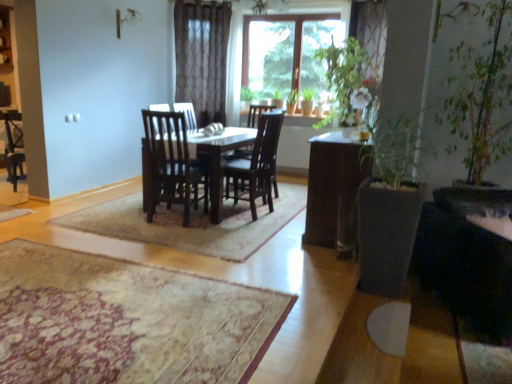
Question: Is beige textured rug at center thinner than metallic silver lamp at upper center?

Choices:
 (A) no
 (B) yes

Answer: (A)

Question: Is the position of beige textured rug at center less distant than that of metallic silver lamp at upper center?

Choices:
 (A) no
 (B) yes

Answer: (B)

Question: Would you say beige textured rug at center is outside metallic silver lamp at upper center?

Choices:
 (A) no
 (B) yes

Answer: (B)

Question: Considering the relative positions of beige textured rug at center and metallic silver lamp at upper center in the image provided, is beige textured rug at center to the right of metallic silver lamp at upper center from the viewer's perspective?

Choices:
 (A) yes
 (B) no

Answer: (A)

Question: Can you confirm if beige textured rug at center is wider than metallic silver lamp at upper center?

Choices:
 (A) no
 (B) yes

Answer: (B)

Question: From a real-world perspective, is beige textured rug at center physically above metallic silver lamp at upper center?

Choices:
 (A) yes
 (B) no

Answer: (B)

Question: Is metallic silver lamp at upper center completely or partially outside of beige textured rug at center?

Choices:
 (A) no
 (B) yes

Answer: (B)

Question: Is metallic silver lamp at upper center thinner than beige textured rug at center?

Choices:
 (A) no
 (B) yes

Answer: (B)

Question: From the image's perspective, would you say metallic silver lamp at upper center is positioned over beige textured rug at center?

Choices:
 (A) yes
 (B) no

Answer: (A)

Question: Is metallic silver lamp at upper center smaller than beige textured rug at center?

Choices:
 (A) no
 (B) yes

Answer: (B)

Question: Is metallic silver lamp at upper center oriented away from beige textured rug at center?

Choices:
 (A) yes
 (B) no

Answer: (B)

Question: Considering the relative positions of metallic silver lamp at upper center and beige textured rug at center in the image provided, is metallic silver lamp at upper center to the left of beige textured rug at center from the viewer's perspective?

Choices:
 (A) no
 (B) yes

Answer: (B)

Question: From a real-world perspective, is metallic silver lamp at upper center physically below matte white cabinet at upper left?

Choices:
 (A) no
 (B) yes

Answer: (A)